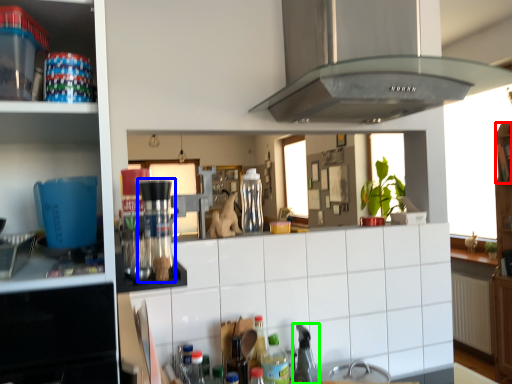
Question: Considering the real-world distances, which object is closest to shelf (highlighted by a red box)? coffee machine (highlighted by a blue box) or appliance (highlighted by a green box).

Choices:
 (A) coffee machine
 (B) appliance

Answer: (B)